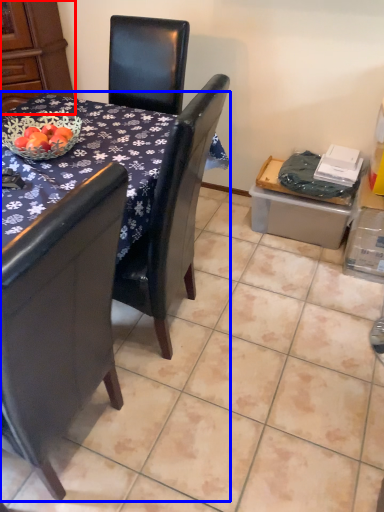
Question: Which object is closer to the camera taking this photo, armoire (highlighted by a red box) or table (highlighted by a blue box)?

Choices:
 (A) armoire
 (B) table

Answer: (B)